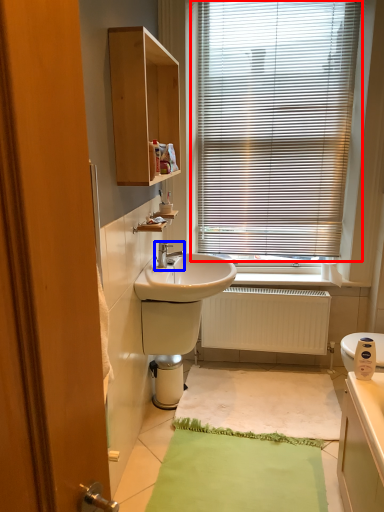
Question: Among these objects, which one is nearest to the camera, window blind (highlighted by a red box) or tap (highlighted by a blue box)?

Choices:
 (A) window blind
 (B) tap

Answer: (B)